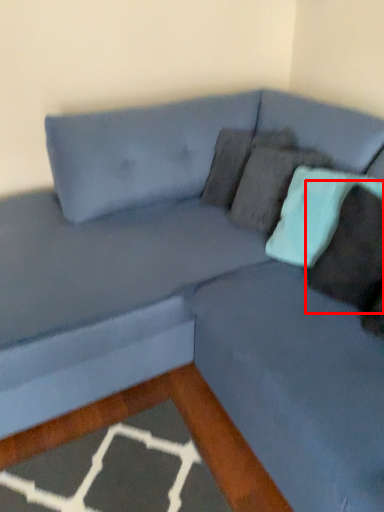
Question: From the image's perspective, what is the correct spatial positioning of pillow (annotated by the red box) in reference to pillow?

Choices:
 (A) above
 (B) below

Answer: (B)